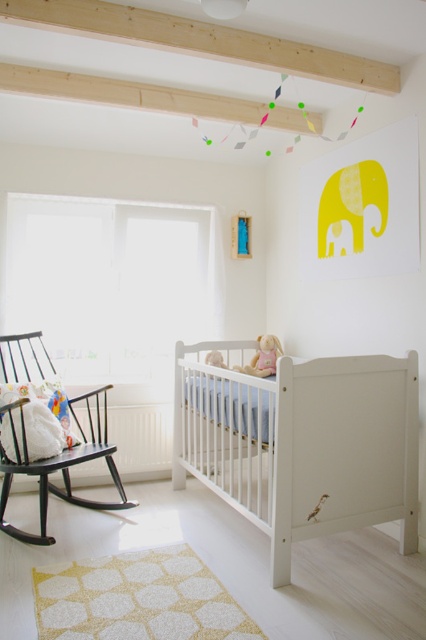
Question: Among these points, which one is farthest from the camera?

Choices:
 (A) (209, 355)
 (B) (276, 488)

Answer: (A)

Question: Is white wooden crib at center bigger than black wood rocking chair at left?

Choices:
 (A) no
 (B) yes

Answer: (B)

Question: In this image, where is white wooden crib at center located relative to yellow matte baby elephant at center?

Choices:
 (A) right
 (B) left

Answer: (A)

Question: Can you confirm if white wooden crib at center is bigger than yellow matte baby elephant at center?

Choices:
 (A) no
 (B) yes

Answer: (B)

Question: Estimate the real-world distances between objects in this image. Which object is farther from the yellow matte baby elephant at center?

Choices:
 (A) white wooden crib at center
 (B) black wood rocking chair at left
 (C) soft pink fabric doll at upper center

Answer: (B)

Question: Which point is closer to the camera?

Choices:
 (A) (253, 372)
 (B) (114, 451)

Answer: (B)